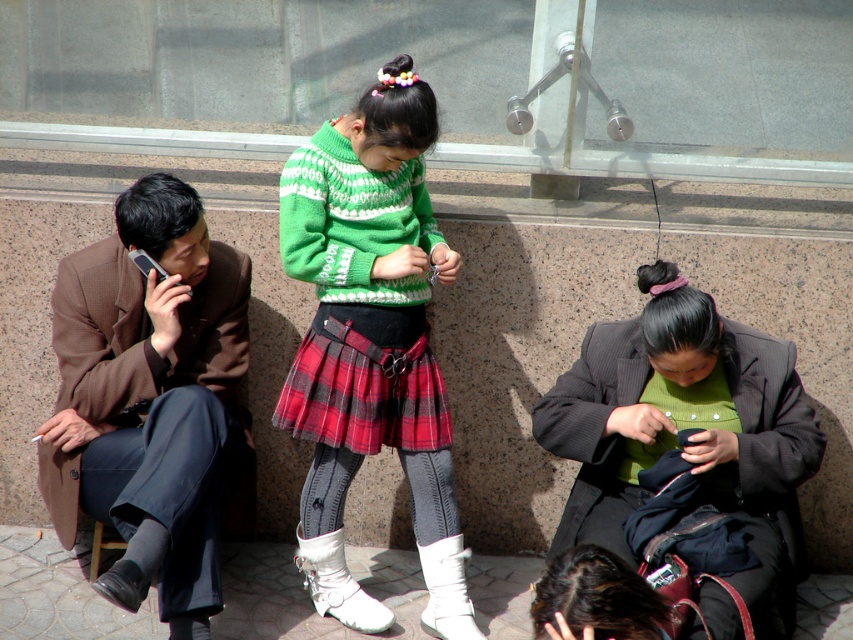
Question: Which object is closer to the camera taking this photo?

Choices:
 (A) green knitted sweater at center
 (B) brown woolen coat at left

Answer: (B)

Question: Can you confirm if brown woolen coat at left is positioned below red plaid skirt at center?

Choices:
 (A) yes
 (B) no

Answer: (A)

Question: Which of the following is the farthest from the observer?

Choices:
 (A) (352, 285)
 (B) (379, 449)
 (C) (190, 202)
 (D) (766, 458)

Answer: (B)

Question: Estimate the real-world distances between objects in this image. Which object is closer to the green woolen sweater at center?

Choices:
 (A) brown woolen coat at left
 (B) green knitted sweater at center
 (C) red plaid skirt at center

Answer: (C)

Question: Does brown woolen coat at left appear under green woolen sweater at center?

Choices:
 (A) yes
 (B) no

Answer: (B)

Question: Is the position of green knitted sweater at center less distant than that of red plaid skirt at center?

Choices:
 (A) yes
 (B) no

Answer: (A)